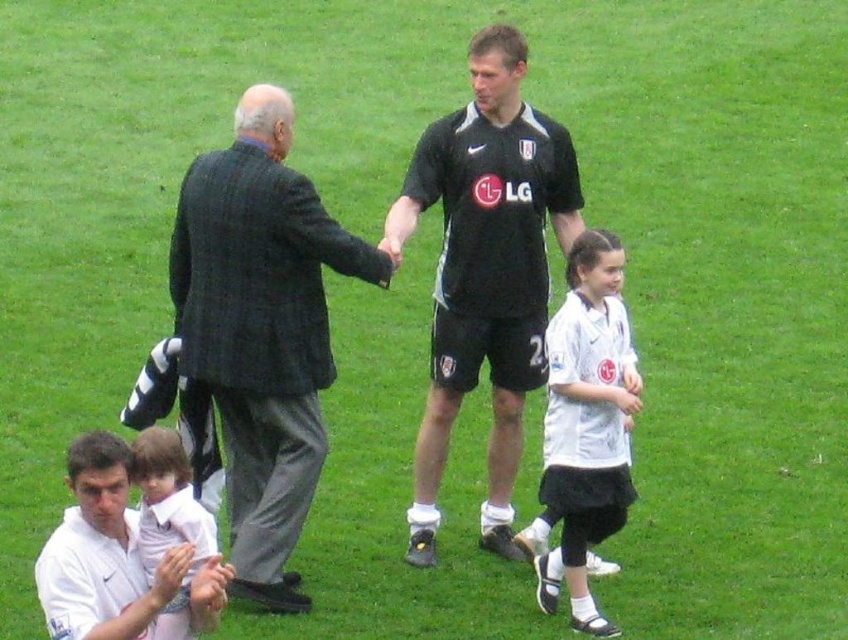
Question: Is the position of white jersey at center more distant than that of light pink fabric at lower left?

Choices:
 (A) no
 (B) yes

Answer: (B)

Question: Among these points, which one is farthest from the camera?

Choices:
 (A) (300, 396)
 (B) (590, 381)
 (C) (192, 499)
 (D) (414, 561)

Answer: (D)

Question: Does dark gray textured suit at left have a smaller size compared to white jersey at center?

Choices:
 (A) no
 (B) yes

Answer: (A)

Question: Is dark gray textured suit at left smaller than white jersey at center?

Choices:
 (A) no
 (B) yes

Answer: (A)

Question: Which object is farther from the camera taking this photo?

Choices:
 (A) light pink fabric at lower left
 (B) black jersey at center
 (C) dark gray textured suit at left

Answer: (B)

Question: Which point is closer to the camera?

Choices:
 (A) (173, 516)
 (B) (584, 506)

Answer: (A)